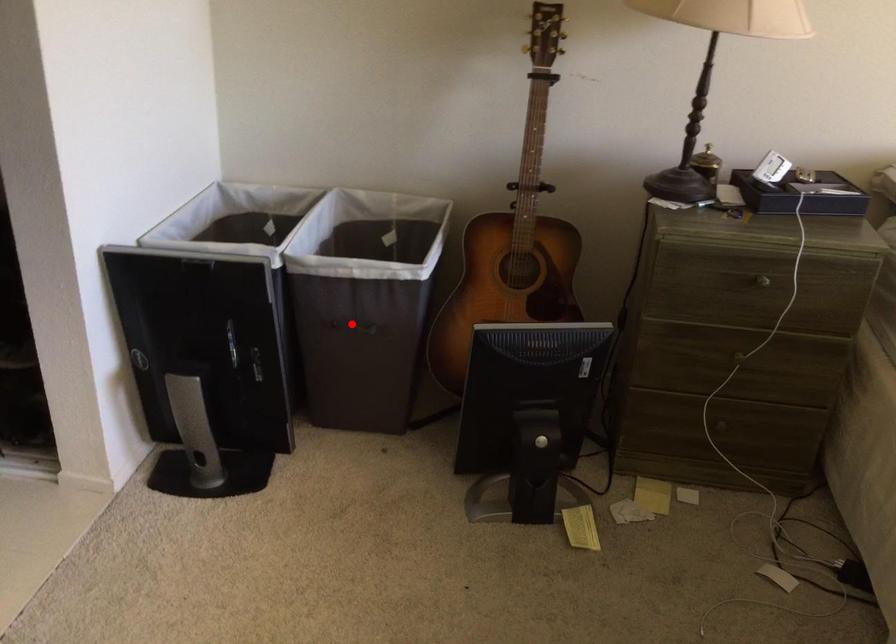
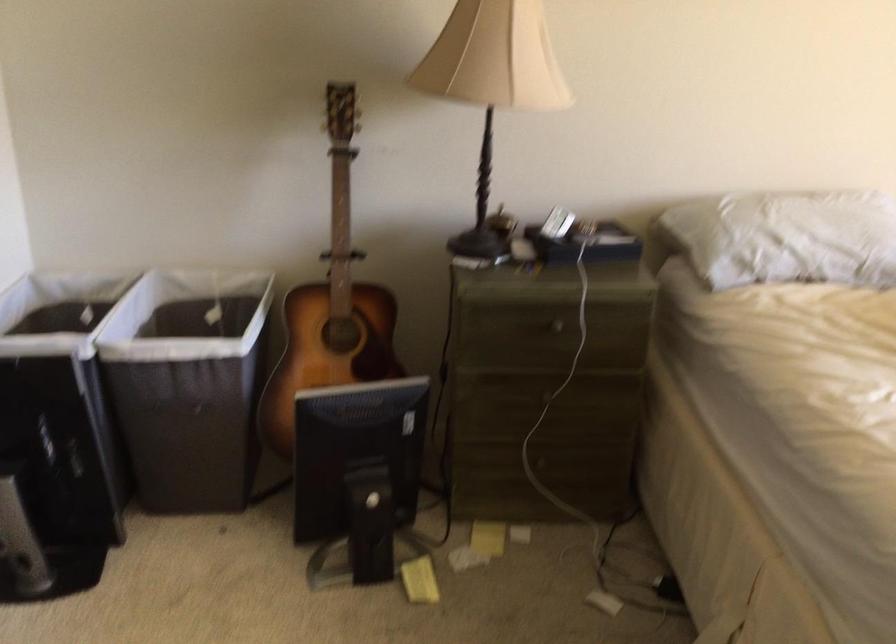
The point at the highlighted location is marked in the first image. Where is the corresponding point in the second image?

(181, 406)